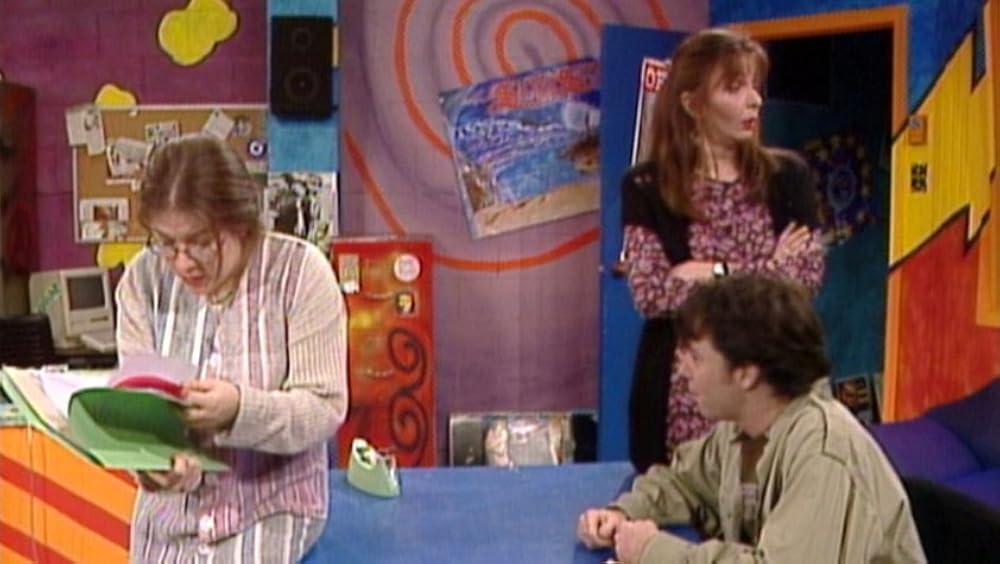
Locate an element on the screen. cork board is located at coordinates (131, 122).